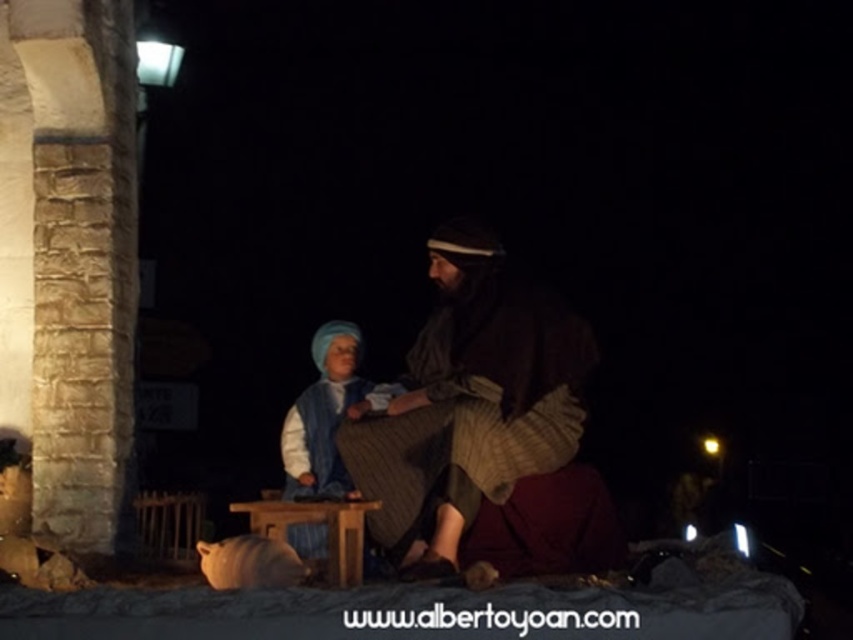
You are setting up a nativity scene and have a brown textured fabric at center and a wooden stool at center. Which object has a greater width?

The brown textured fabric at center has a greater width than the wooden stool at center.